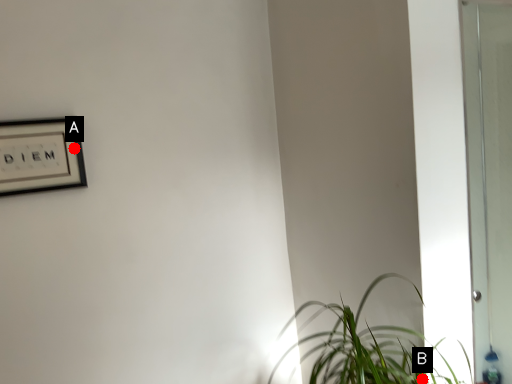
Question: Two points are circled on the image, labeled by A and B beside each circle. Which point is closer to the camera?

Choices:
 (A) A is closer
 (B) B is closer

Answer: (B)